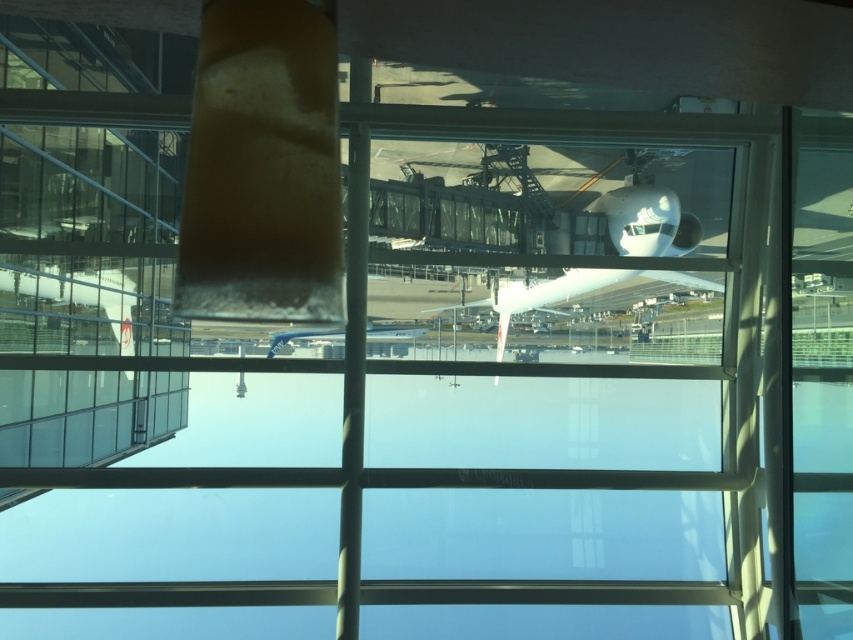
You are standing inside an airport terminal looking through a large glass window. You notice a white glossy airplane at center represented by point (645,214). If you were to draw a straight line from your eye level to this point, would it intersect the jet bridge?

The white glossy airplane at center is represented by point (645,214). Since the jet bridge extends from the terminal towards the airplane, the straight line from your eye level to the airplane would pass through the jet bridge, so yes, it would intersect the jet bridge.

You are an airport staff member standing inside the terminal near the window. You see the white glossy airplane at center and the blue metallic airplane at center through the window. Which airplane is positioned more to the right side from your viewpoint?

The white glossy airplane at center is positioned more to the right side from your viewpoint compared to the blue metallic airplane at center.

You are standing inside the airport terminal near the large glass window. You notice the white glossy airplane at center reflected in the window. Based on the reflection, can you determine the airplane is positioned to the left or right side of the window?

The white glossy airplane at center is located at point coordinates that are to the left side of the window.